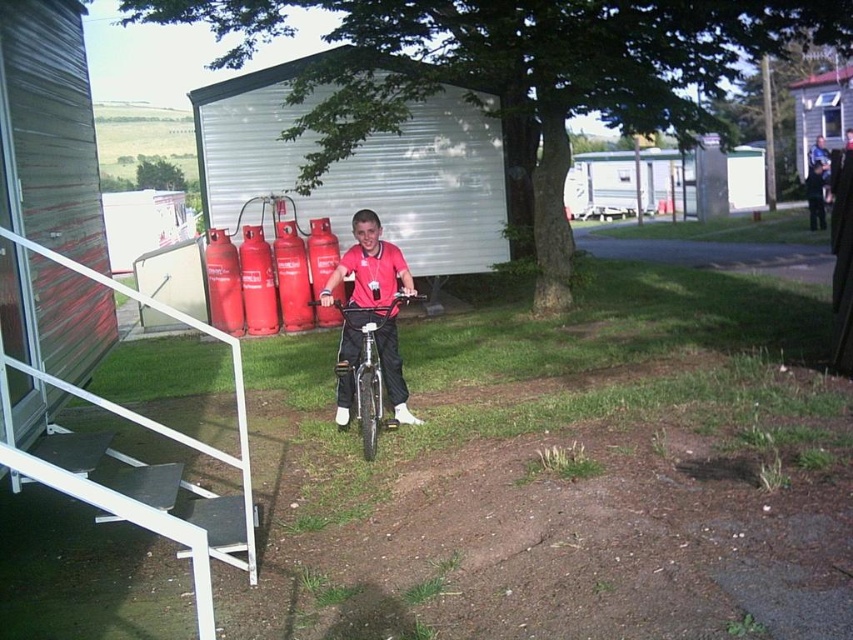
Question: Is blue denim shirt at upper right below white plastic pole at upper center?

Choices:
 (A) yes
 (B) no

Answer: (A)

Question: Is blue denim shirt at upper right below white plastic pole at upper center?

Choices:
 (A) yes
 (B) no

Answer: (A)

Question: Does brushed metal pole at upper right appear under white plastic pole at upper center?

Choices:
 (A) yes
 (B) no

Answer: (A)

Question: Which point is closer to the camera?

Choices:
 (A) white plastic pole at upper center
 (B) blue denim shirt at upper right
 (C) brushed metal pole at upper right
 (D) shiny metallic bicycle at center

Answer: (D)

Question: Which point appears farthest from the camera in this image?

Choices:
 (A) pos(378,429)
 (B) pos(766,124)
 (C) pos(824,170)
 (D) pos(637,156)

Answer: (D)

Question: Which object is the farthest from the blue denim shirt at upper right?

Choices:
 (A) white plastic pole at upper center
 (B) shiny metallic bicycle at center

Answer: (B)